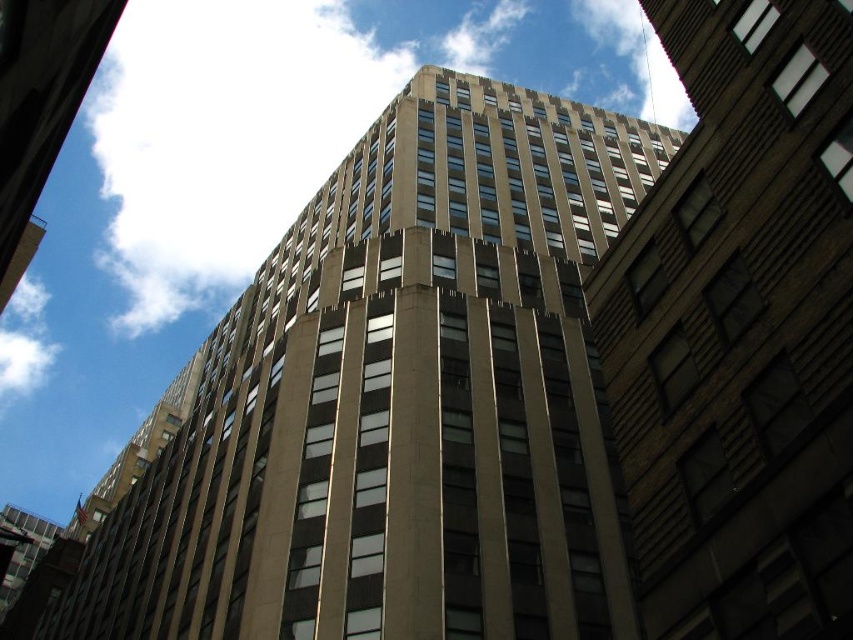
Who is taller, brown stone building at center or white fluffy cloud at upper center?

Standing taller between the two is white fluffy cloud at upper center.

Between point (637, 476) and point (109, 154), which one is positioned behind?

Point (109, 154)

The width and height of the screenshot is (853, 640). I want to click on brown stone building at center, so click(x=740, y=330).

Can you confirm if beige concrete building at center is positioned to the right of white fluffy cloud at upper center?

Indeed, beige concrete building at center is positioned on the right side of white fluffy cloud at upper center.

Which of these two, beige concrete building at center or white fluffy cloud at upper center, stands shorter?

beige concrete building at center

Is point (573, 300) closer to camera compared to point (358, 52)?

Yes, point (573, 300) is in front of point (358, 52).

Locate an element on the screen. beige concrete building at center is located at coordinates (399, 401).

Is beige concrete building at center closer to the viewer compared to brown stone building at center?

No, it is behind brown stone building at center.

Describe the element at coordinates (399, 401) in the screenshot. I see `beige concrete building at center` at that location.

Image resolution: width=853 pixels, height=640 pixels. Identify the location of beige concrete building at center. (399, 401).

This screenshot has width=853, height=640. Identify the location of beige concrete building at center. (x=399, y=401).